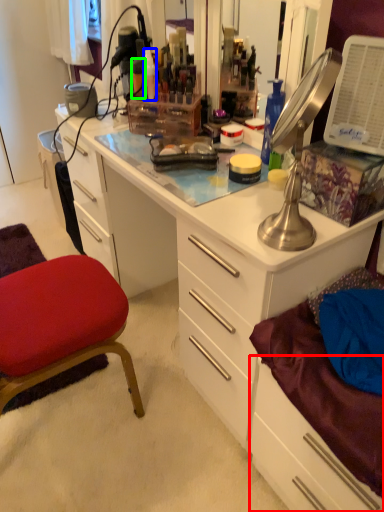
Question: Considering the real-world distances, which object is closest to drawer (highlighted by a red box)? toiletry (highlighted by a blue box) or toiletry (highlighted by a green box).

Choices:
 (A) toiletry
 (B) toiletry

Answer: (A)